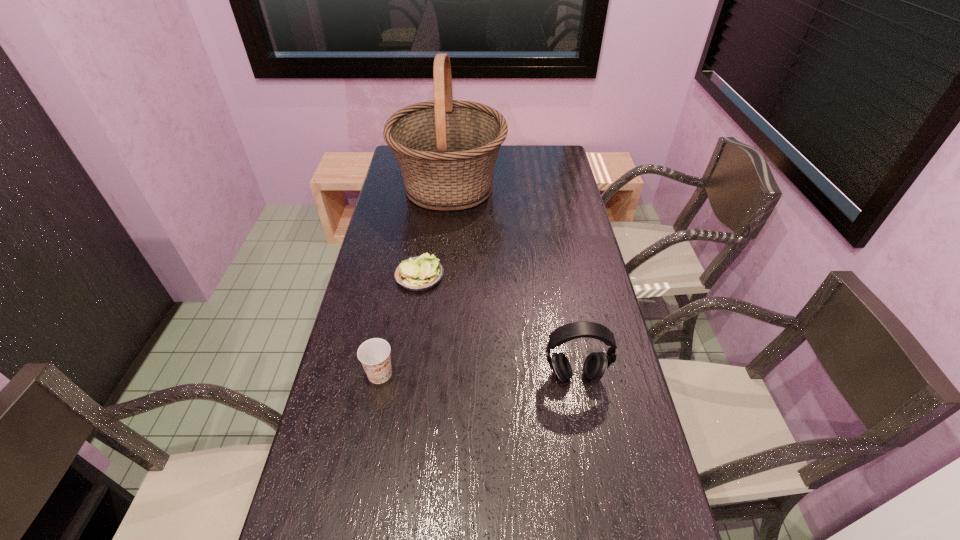
I want to click on vacant space located 0.090m on the front of the shortest object, so click(414, 314).

Where is `object present at the far edge`? The image size is (960, 540). object present at the far edge is located at coordinates (446, 149).

What are the coordinates of `basket that is at the left edge` in the screenshot? It's located at (446, 149).

What are the coordinates of `Dixie cup at the left edge` in the screenshot? It's located at (374, 354).

Locate an element on the screen. The width and height of the screenshot is (960, 540). lettuce positioned at the left edge is located at coordinates (419, 273).

Locate an element on the screen. Image resolution: width=960 pixels, height=540 pixels. object located at the right edge is located at coordinates (595, 365).

Identify the location of object situated at the far left corner. The image size is (960, 540). coord(446,149).

Identify the location of free space at the far edge of the desktop. The image size is (960, 540). (508, 148).

Where is `vacant space at the left edge of the desktop`? Image resolution: width=960 pixels, height=540 pixels. vacant space at the left edge of the desktop is located at coordinates (374, 267).

In the image, there is a desktop. Where is `vacant space at the right edge`? Image resolution: width=960 pixels, height=540 pixels. vacant space at the right edge is located at coordinates (546, 225).